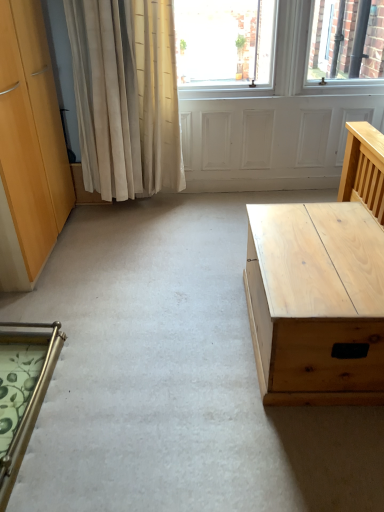
This screenshot has height=512, width=384. What do you see at coordinates (316, 302) in the screenshot?
I see `light wood/texture desk at right` at bounding box center [316, 302].

At what (x,y) coordinates should I click in order to perform the action: click on light wood/texture desk at right. Please return your answer as a coordinate pair (x, y). Image resolution: width=384 pixels, height=512 pixels. Looking at the image, I should click on (316, 302).

What do you see at coordinates (22, 391) in the screenshot?
I see `gold metallic chair at lower left` at bounding box center [22, 391].

Locate an element on the screen. This screenshot has height=512, width=384. gold metallic chair at lower left is located at coordinates (22, 391).

What is the approximate height of gold metallic chair at lower left?

gold metallic chair at lower left is 5.74 inches tall.

At what (x,y) coordinates should I click in order to perform the action: click on light wood/texture desk at right. Please return your answer as a coordinate pair (x, y). Looking at the image, I should click on (316, 302).

Does gold metallic chair at lower left appear on the right side of light wood/texture desk at right?

No.

In the image, is gold metallic chair at lower left positioned in front of or behind light wood/texture desk at right?

In the image, gold metallic chair at lower left appears in front of light wood/texture desk at right.

Considering the points (26, 333) and (273, 285), which point is in front, point (26, 333) or point (273, 285)?

The point (273, 285) is closer.

In the scene shown: From the image's perspective, is gold metallic chair at lower left over light wood/texture desk at right?

Incorrect, from the image's perspective, gold metallic chair at lower left is lower than light wood/texture desk at right.

From a real-world perspective, between gold metallic chair at lower left and light wood/texture desk at right, who is vertically lower?

In real-world perspective, gold metallic chair at lower left is lower.

Is gold metallic chair at lower left wider than light wood/texture desk at right?

No.

Is gold metallic chair at lower left taller or shorter than light wood/texture desk at right?

In the image, gold metallic chair at lower left appears to be shorter than light wood/texture desk at right.

Is gold metallic chair at lower left smaller than light wood/texture desk at right?

Yes.

Is gold metallic chair at lower left not within light wood/texture desk at right?

Indeed, gold metallic chair at lower left is completely outside light wood/texture desk at right.

Consider the image. Is gold metallic chair at lower left next to light wood/texture desk at right?

No, gold metallic chair at lower left is not beside light wood/texture desk at right.

Is gold metallic chair at lower left facing away from light wood/texture desk at right?

That's not correct — gold metallic chair at lower left is not looking away from light wood/texture desk at right.

What's the angular difference between gold metallic chair at lower left and light wood/texture desk at right's facing directions?

gold metallic chair at lower left and light wood/texture desk at right are facing 179 degrees away from each other.

At what (x,y) coordinates should I click in order to perform the action: click on desk behind the gold metallic chair at lower left. Please return your answer as a coordinate pair (x, y). This screenshot has width=384, height=512. Looking at the image, I should click on (316, 302).

Can you confirm if light wood/texture desk at right is positioned to the left of gold metallic chair at lower left?

In fact, light wood/texture desk at right is to the right of gold metallic chair at lower left.

Considering the relative positions of light wood/texture desk at right and gold metallic chair at lower left in the image provided, is light wood/texture desk at right in front of gold metallic chair at lower left?

No.

Which point is more distant from viewer, (340, 279) or (15, 465)?

The point (340, 279) is behind.

From the image's perspective, between light wood/texture desk at right and gold metallic chair at lower left, who is located below?

gold metallic chair at lower left appears lower in the image.

Looking at this image, from a real-world perspective, relative to gold metallic chair at lower left, is light wood/texture desk at right vertically above or below?

In terms of real-world spatial position, light wood/texture desk at right is above gold metallic chair at lower left.

Can you confirm if light wood/texture desk at right is thinner than gold metallic chair at lower left?

No, light wood/texture desk at right is not thinner than gold metallic chair at lower left.

Can you confirm if light wood/texture desk at right is taller than gold metallic chair at lower left?

Yes, light wood/texture desk at right is taller than gold metallic chair at lower left.

Is light wood/texture desk at right bigger than gold metallic chair at lower left?

Yes.

Is light wood/texture desk at right completely or partially outside of gold metallic chair at lower left?

Absolutely, light wood/texture desk at right is external to gold metallic chair at lower left.

Is there a large distance between light wood/texture desk at right and gold metallic chair at lower left?

light wood/texture desk at right is positioned a significant distance from gold metallic chair at lower left.

Based on the photo, is light wood/texture desk at right aimed at gold metallic chair at lower left?

Yes, light wood/texture desk at right is oriented towards gold metallic chair at lower left.

Measure the distance between light wood/texture desk at right and gold metallic chair at lower left.

light wood/texture desk at right and gold metallic chair at lower left are 3.49 feet apart.

Find the location of a particular element. chair on the left side of light wood/texture desk at right is located at coordinates (22, 391).

Image resolution: width=384 pixels, height=512 pixels. Identify the location of chair in front of the light wood/texture desk at right. (22, 391).

Where is `chair below the light wood/texture desk at right (from the image's perspective)`? This screenshot has height=512, width=384. chair below the light wood/texture desk at right (from the image's perspective) is located at coordinates (22, 391).